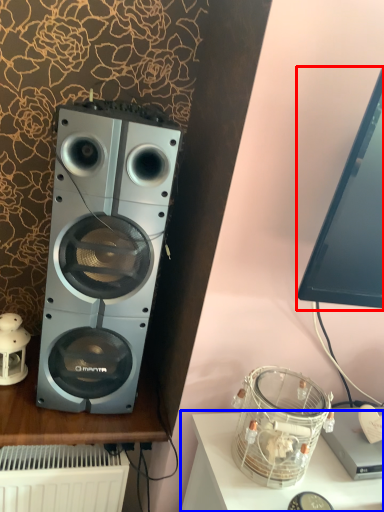
Question: Which of the following is the farthest to the observer, computer monitor (highlighted by a red box) or furniture (highlighted by a blue box)?

Choices:
 (A) computer monitor
 (B) furniture

Answer: (B)